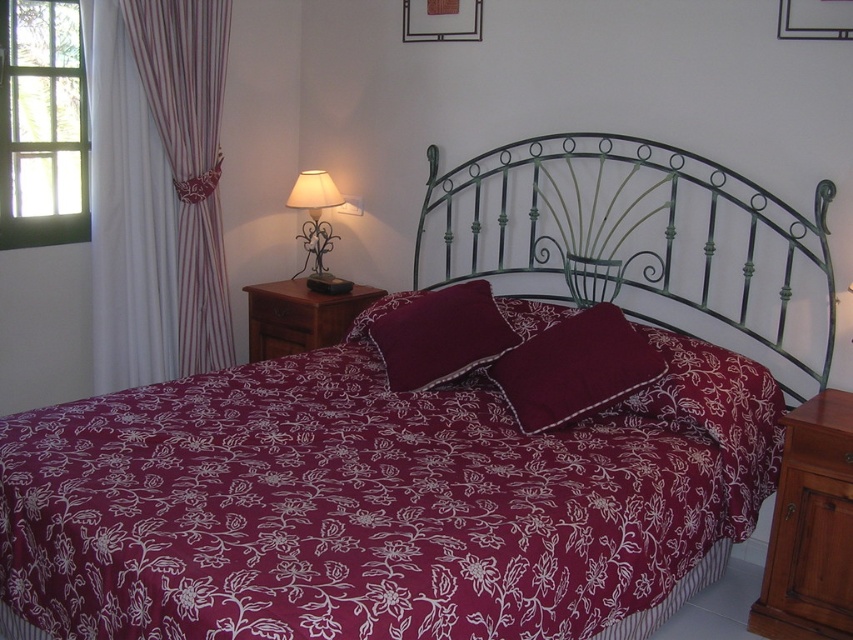
Can you confirm if clear glass window at left is taller than maroon fabric pillow at center?

Correct, clear glass window at left is much taller as maroon fabric pillow at center.

Based on the photo, is the position of clear glass window at left less distant than that of maroon fabric pillow at center?

No, it is not.

Which is behind, point (71, 164) or point (378, 342)?

Point (71, 164)

Image resolution: width=853 pixels, height=640 pixels. What are the coordinates of `clear glass window at left` in the screenshot? It's located at (42, 124).

Between brown wooden dresser at lower right and metallic wrought iron lamp at upper right, which one has more height?

Standing taller between the two is brown wooden dresser at lower right.

Between point (753, 621) and point (316, 262), which one is positioned behind?

The point (316, 262) is more distant.

Find the location of a particular element. Image resolution: width=853 pixels, height=640 pixels. brown wooden dresser at lower right is located at coordinates (810, 528).

Is clear glass window at left taller than brown wooden dresser at lower right?

Indeed, clear glass window at left has a greater height compared to brown wooden dresser at lower right.

How much distance is there between clear glass window at left and brown wooden dresser at lower right?

clear glass window at left is 2.89 meters away from brown wooden dresser at lower right.

Between point (64, 65) and point (780, 522), which one is positioned in front?

Positioned in front is point (780, 522).

Find the location of `clear glass window at left`. clear glass window at left is located at coordinates (42, 124).